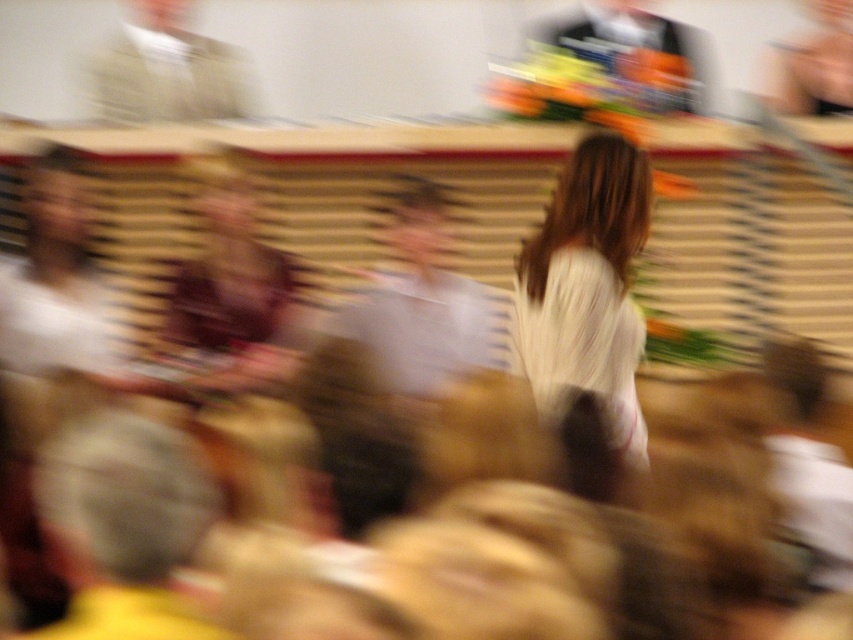
You are a photographer trying to capture a clear shot of the light blue shirt at center and the shiny metallic vase at upper right. Since the scene is blurry, you decide to adjust your camera settings to reduce motion blur. Which object should you focus on first if you want to ensure the thinner object is sharp?

The light blue shirt at center is thinner than the shiny metallic vase at upper right, so you should focus on the light blue shirt at center first to ensure its thinner form is captured sharply.

Looking at this image, you are at a social event and want to take a photo of both the point at coordinates (613, 417) and the point at coordinates (698, 109). Considering their positions, which point should you focus on first to ensure both are in clear view?

You should focus on point (613, 417) first because it is closer to the camera than point (698, 109). By focusing on the closer point, the depth of field may help keep both points in acceptable focus.